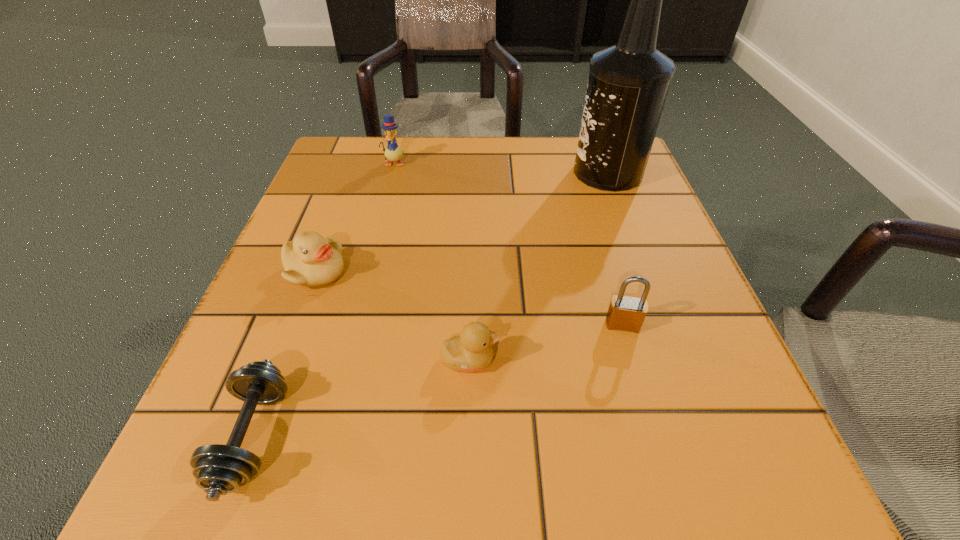
This screenshot has height=540, width=960. In order to click on the tallest object in this screenshot , I will do `click(628, 83)`.

The width and height of the screenshot is (960, 540). I want to click on the second duckling from right to left, so click(392, 152).

Locate an element on the screen. the farthest duckling is located at coordinates (392, 152).

Identify the location of padlock. (x=625, y=313).

Where is `the second nearest duckling`? the second nearest duckling is located at coordinates (310, 260).

Identify the location of the third farthest object. The width and height of the screenshot is (960, 540). (310, 260).

Find the location of `the rightmost duckling`. the rightmost duckling is located at coordinates (471, 351).

Where is `the shortest duckling`? the shortest duckling is located at coordinates (471, 351).

The width and height of the screenshot is (960, 540). In order to click on dumbbell in this screenshot , I will do `click(219, 469)`.

Identify the location of vacant position located 0.250m on the front label of the liquor. (458, 173).